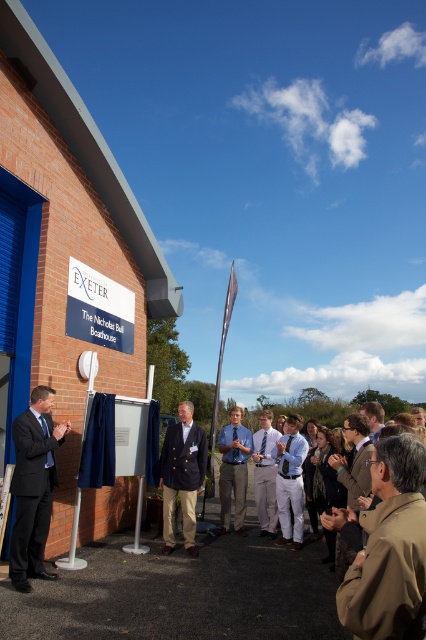
You are standing at the event at The Nicholas Bull Boathouse. There is a point marked at coordinates (386, 490). If you want to place a decoration 2 meters away from where you are standing, can you place it exactly at that point?

Yes, the point at coordinates (386, 490) is exactly 2.03 meters away from your current position, which is within the desired distance of 2 meters.

You are standing at the event at The Nicholas Bull Boathouse and notice two points marked in the image. Which point, point (388,604) or point (28,460), is closer to you?

Point (388,604) is closer to the viewer than point (28,460).

You are standing at the entrance of The Nicholas Bull Boathouse and want to find the person wearing the navy blue blazer at center. According to the coordinates provided, in which direction should you look relative to your current position?

The navy blue blazer at center is located at coordinates point 0.744 on the x axis and 0.427 on the y axis. Since the coordinate system typically places the origin at the bottom left corner of the image, 0.744 on the x axis means it is to the right side of the image, and 0.427 on the y axis places it slightly above the middle. Therefore, you should look towards the upper right direction from your current position at the entrance.